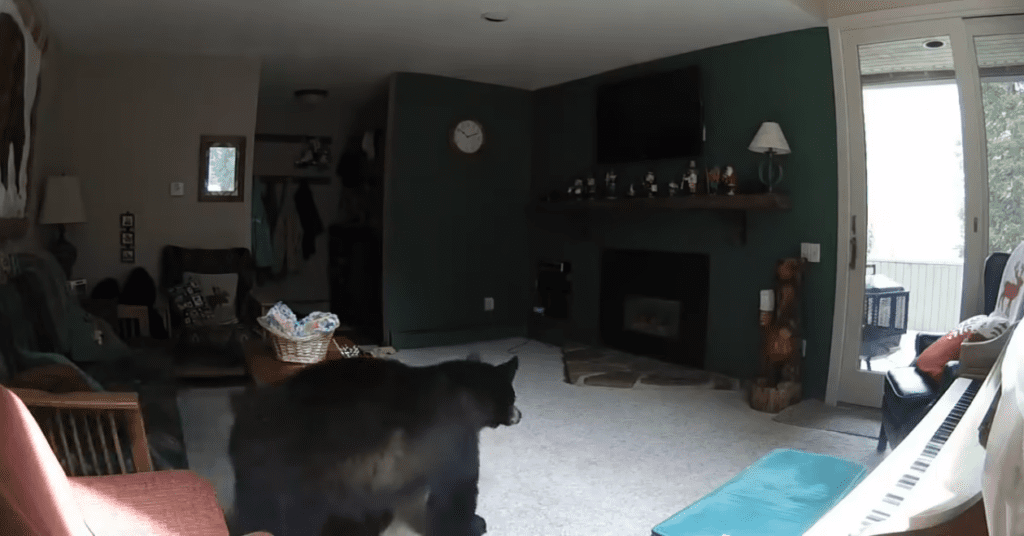
Find the location of a particular element. This screenshot has width=1024, height=536. table lamp is located at coordinates (75, 210).